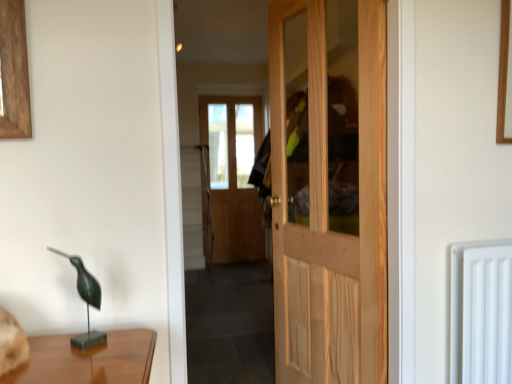
Question: Would you say white plastic radiator at right is a long distance from green patina metal bird at left?

Choices:
 (A) no
 (B) yes

Answer: (B)

Question: Can green patina metal bird at left be found inside white plastic radiator at right?

Choices:
 (A) yes
 (B) no

Answer: (B)

Question: Does white plastic radiator at right appear on the left side of green patina metal bird at left?

Choices:
 (A) yes
 (B) no

Answer: (B)

Question: From the image's perspective, is white plastic radiator at right below green patina metal bird at left?

Choices:
 (A) no
 (B) yes

Answer: (B)

Question: Considering the relative sizes of white plastic radiator at right and green patina metal bird at left in the image provided, is white plastic radiator at right shorter than green patina metal bird at left?

Choices:
 (A) yes
 (B) no

Answer: (B)

Question: Looking at their shapes, would you say natural wood door at center is wider or thinner than green patina metal bird at left?

Choices:
 (A) thin
 (B) wide

Answer: (B)

Question: From a real-world perspective, is natural wood door at center physically located above or below green patina metal bird at left?

Choices:
 (A) below
 (B) above

Answer: (B)

Question: In the image, is natural wood door at center on the left side or the right side of green patina metal bird at left?

Choices:
 (A) right
 (B) left

Answer: (A)

Question: From the image's perspective, is natural wood door at center located above or below green patina metal bird at left?

Choices:
 (A) below
 (B) above

Answer: (B)

Question: From a real-world perspective, is white plastic radiator at right above or below green patina metal bird at left?

Choices:
 (A) above
 (B) below

Answer: (B)

Question: From the image's perspective, relative to green patina metal bird at left, is white plastic radiator at right above or below?

Choices:
 (A) below
 (B) above

Answer: (A)

Question: In terms of height, does white plastic radiator at right look taller or shorter compared to green patina metal bird at left?

Choices:
 (A) tall
 (B) short

Answer: (A)

Question: Relative to green patina metal bird at left, is white plastic radiator at right in front or behind?

Choices:
 (A) behind
 (B) front

Answer: (A)

Question: Does point (451, 350) appear closer or farther from the camera than point (335, 225)?

Choices:
 (A) farther
 (B) closer

Answer: (B)

Question: Is white plastic radiator at right to the left or to the right of natural wood door at center in the image?

Choices:
 (A) right
 (B) left

Answer: (A)